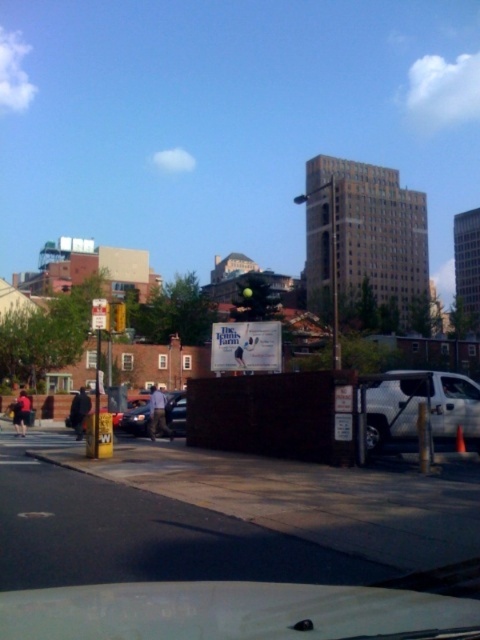
Who is more distant from viewer, (85, 403) or (120, 317)?

Positioned behind is point (85, 403).

Is black matte jacket at lower left above yellow plastic traffic light at upper left?

Incorrect, black matte jacket at lower left is not positioned above yellow plastic traffic light at upper left.

Is point (72, 401) more distant than point (123, 312)?

Yes, it is.

The width and height of the screenshot is (480, 640). I want to click on black matte jacket at lower left, so click(79, 412).

Does white matte truck at right lie in front of dark blue jeans at lower left?

Yes, white matte truck at right is closer to the viewer.

Based on the photo, who is more distant from viewer, (x=475, y=406) or (x=22, y=404)?

Point (x=22, y=404)

You are a GUI agent. You are given a task and a screenshot of the screen. Output one action in this format:
    pyautogui.click(x=<x>, y=<y>)
    Task: Click on the white matte truck at right
    This screenshot has height=640, width=480.
    Given the screenshot: What is the action you would take?
    pyautogui.click(x=418, y=404)

Looking at this image, which of these two, gray fabric shirt at center or transparent glass windshield at center, stands shorter?

With less height is transparent glass windshield at center.

Is the position of gray fabric shirt at center less distant than that of transparent glass windshield at center?

No, gray fabric shirt at center is further to the viewer.

The image size is (480, 640). In order to click on gray fabric shirt at center in this screenshot , I will do `click(157, 413)`.

Locate an element on the screen. The height and width of the screenshot is (640, 480). gray fabric shirt at center is located at coordinates (157, 413).